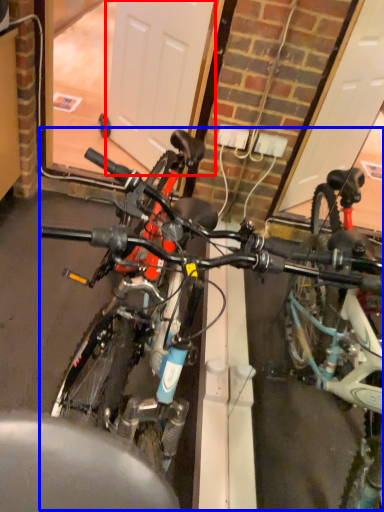
Question: Which object is further to the camera taking this photo, garage door (highlighted by a red box) or bicycle (highlighted by a blue box)?

Choices:
 (A) garage door
 (B) bicycle

Answer: (A)